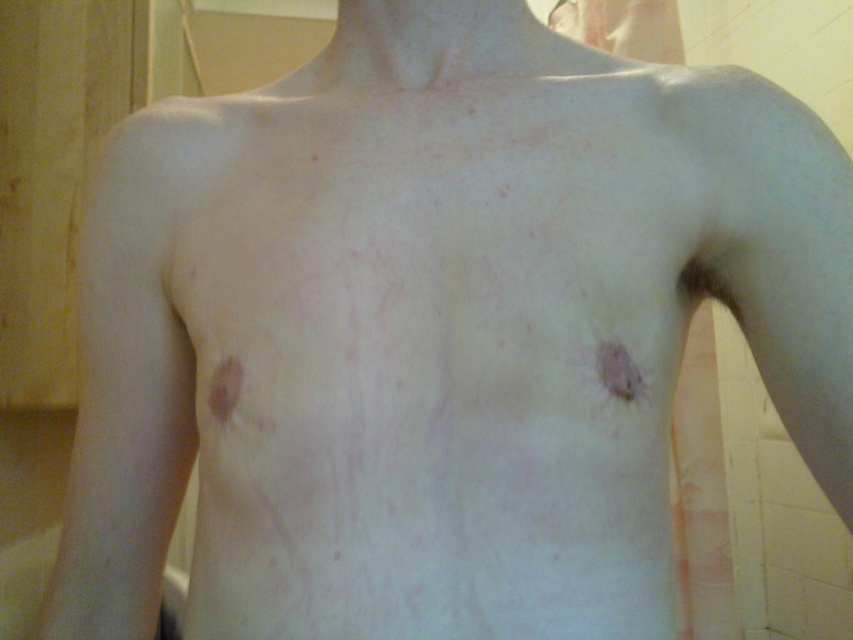
Question: Which point is closer to the camera?

Choices:
 (A) coord(230,378)
 (B) coord(596,368)

Answer: (B)

Question: Is pink matte scar at center bigger than brown matte freckle at left?

Choices:
 (A) no
 (B) yes

Answer: (A)

Question: Which point appears closest to the camera in this image?

Choices:
 (A) (231, 394)
 (B) (618, 394)

Answer: (B)

Question: Is pink matte scar at center to the left of brown matte freckle at left from the viewer's perspective?

Choices:
 (A) yes
 (B) no

Answer: (B)

Question: Observing the image, what is the correct spatial positioning of pink matte scar at center in reference to brown matte freckle at left?

Choices:
 (A) right
 (B) left

Answer: (A)

Question: Among these objects, which one is farthest from the camera?

Choices:
 (A) brown matte freckle at left
 (B) pink matte scar at center

Answer: (A)